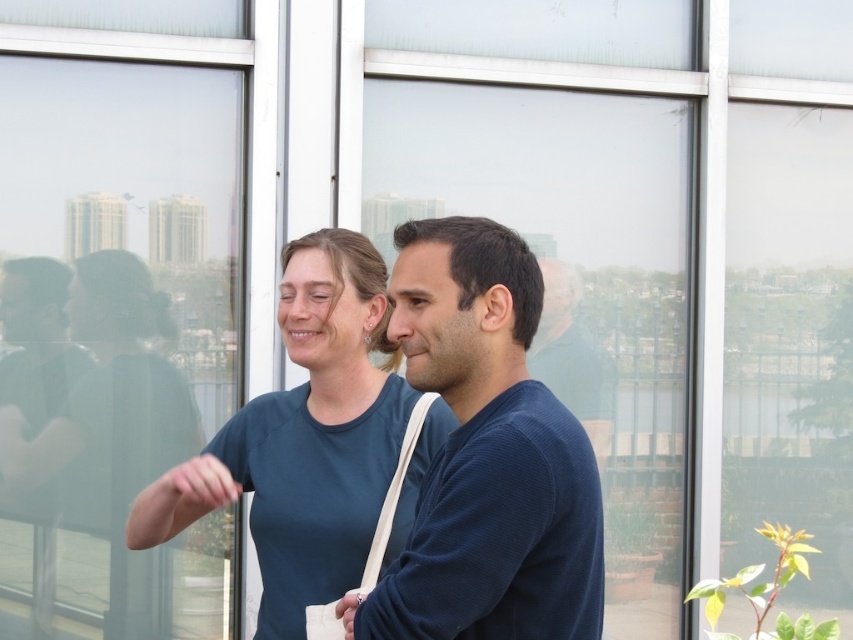
Question: Which object is closer to the camera taking this photo?

Choices:
 (A) transparent glass window at center
 (B) blue knitted sweater at center

Answer: (A)

Question: Which of the following is the closest to the observer?

Choices:
 (A) (35, 28)
 (B) (357, 256)
 (C) (585, 337)

Answer: (B)

Question: Where is dark blue sweater at center located in relation to blue knitted sweater at center in the image?

Choices:
 (A) above
 (B) below

Answer: (B)

Question: Based on their relative distances, which object is farther from the transparent glass window at center?

Choices:
 (A) teal matte shirt at center
 (B) blue knitted sweater at center

Answer: (B)

Question: Does dark blue sweater at center have a larger size compared to blue knitted sweater at center?

Choices:
 (A) no
 (B) yes

Answer: (B)

Question: From the image, what is the correct spatial relationship of transparent glass window at center in relation to blue knitted sweater at center?

Choices:
 (A) right
 (B) left

Answer: (B)